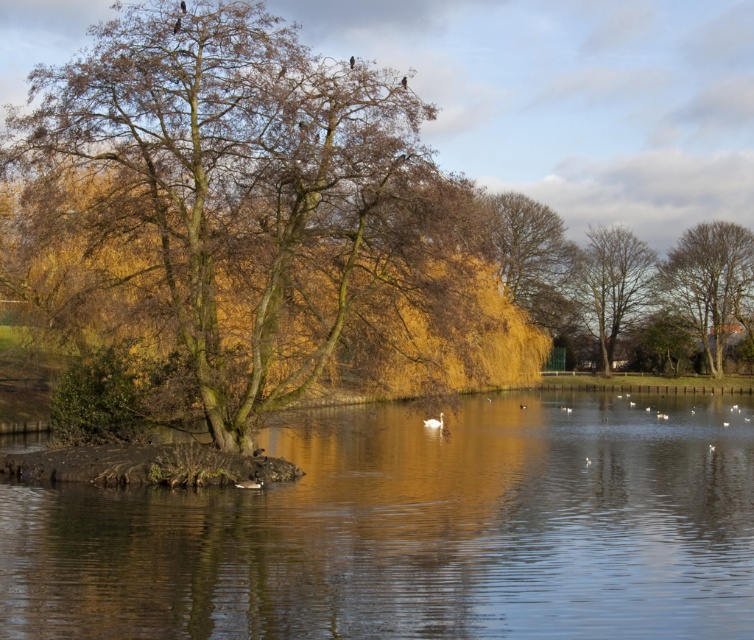
Can you confirm if brown leafy tree at center is taller than brown feathered bird at upper center?

Correct, brown leafy tree at center is much taller as brown feathered bird at upper center.

From the picture: Can you confirm if brown leafy tree at center is wider than brown feathered bird at upper center?

Yes.

Measure the distance between point (161, 100) and camera.

A distance of 92.73 feet exists between point (161, 100) and camera.

In order to click on brown leafy tree at center in this screenshot , I will do `click(250, 218)`.

Is brown leafy tree at right taller than brown feathered bird at upper center?

Indeed, brown leafy tree at right has a greater height compared to brown feathered bird at upper center.

The image size is (754, 640). What are the coordinates of `brown leafy tree at right` in the screenshot? It's located at (710, 282).

Who is more distant from viewer, (733,474) or (182,4)?

Positioned behind is point (733,474).

Between clear water at center and brown feathered bird at upper center, which one has more height?

Standing taller between the two is clear water at center.

Measure the distance between clear water at center and camera.

The distance of clear water at center from camera is 11.97 meters.

You are a GUI agent. You are given a task and a screenshot of the screen. Output one action in this format:
    pyautogui.click(x=<x>, y=<y>)
    Task: Click on the clear water at center
    This screenshot has width=754, height=640.
    Given the screenshot: What is the action you would take?
    pyautogui.click(x=415, y=531)